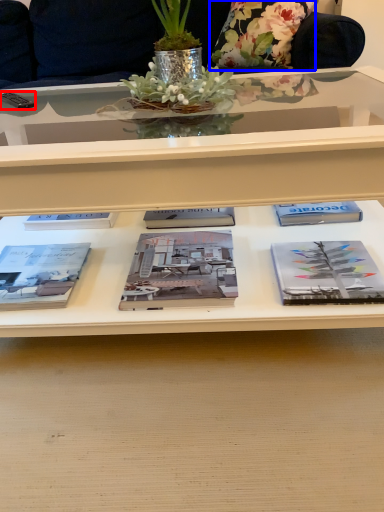
Question: Which of the following is the farthest to the observer, remote control (highlighted by a red box) or flower (highlighted by a blue box)?

Choices:
 (A) remote control
 (B) flower

Answer: (B)